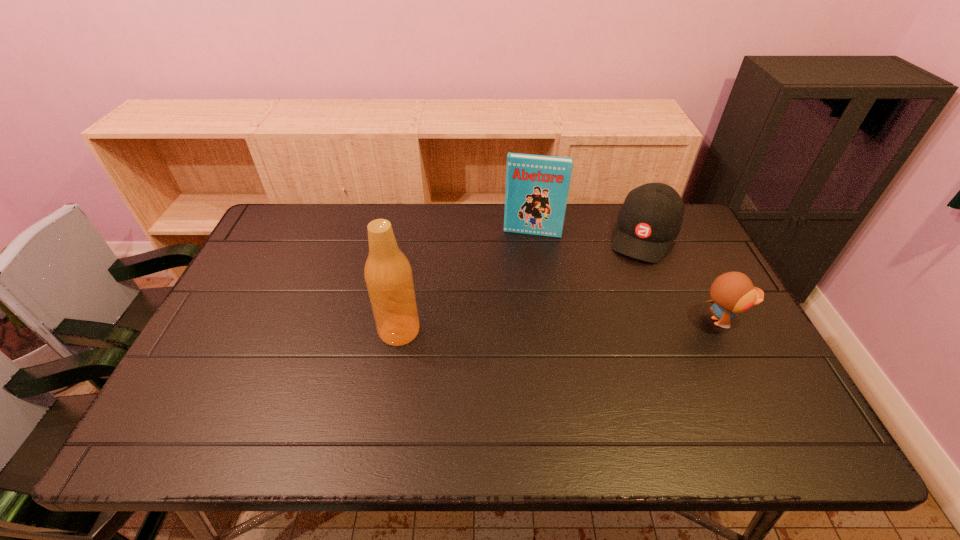
This screenshot has width=960, height=540. I want to click on the leftmost object, so click(x=388, y=275).

The image size is (960, 540). Identify the location of beer bottle. (388, 275).

Image resolution: width=960 pixels, height=540 pixels. I want to click on duck, so click(733, 292).

Identify the location of the third shortest object. Image resolution: width=960 pixels, height=540 pixels. (537, 186).

You are a GUI agent. You are given a task and a screenshot of the screen. Output one action in this format:
    pyautogui.click(x=<x>, y=<y>)
    Task: Click on the third object from right to left
    
    Given the screenshot: What is the action you would take?
    pyautogui.click(x=537, y=186)

Find the location of a particular element. baseball cap is located at coordinates (650, 219).

The height and width of the screenshot is (540, 960). What are the coordinates of `free space located 0.090m on the front of the leftmost object` in the screenshot? It's located at (392, 378).

Image resolution: width=960 pixels, height=540 pixels. Identify the location of free space located 0.180m on the front cover of the book. (522, 275).

You are a GUI agent. You are given a task and a screenshot of the screen. Output one action in this format:
    pyautogui.click(x=<x>, y=<y>)
    Task: Click on the free space located on the front cover of the book
    
    Given the screenshot: What is the action you would take?
    pyautogui.click(x=527, y=248)

You are a GUI agent. You are given a task and a screenshot of the screen. Output one action in this format:
    pyautogui.click(x=<x>, y=<y>)
    Task: Click on the vacant space located on the front cover of the book
    
    Given the screenshot: What is the action you would take?
    pyautogui.click(x=522, y=275)